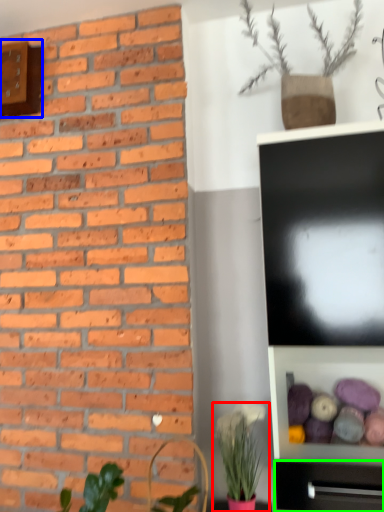
Question: Which object is the farthest from houseplant (highlighted by a red box)? Choose among these: clock (highlighted by a blue box) or tv cabinet (highlighted by a green box).

Choices:
 (A) clock
 (B) tv cabinet

Answer: (A)